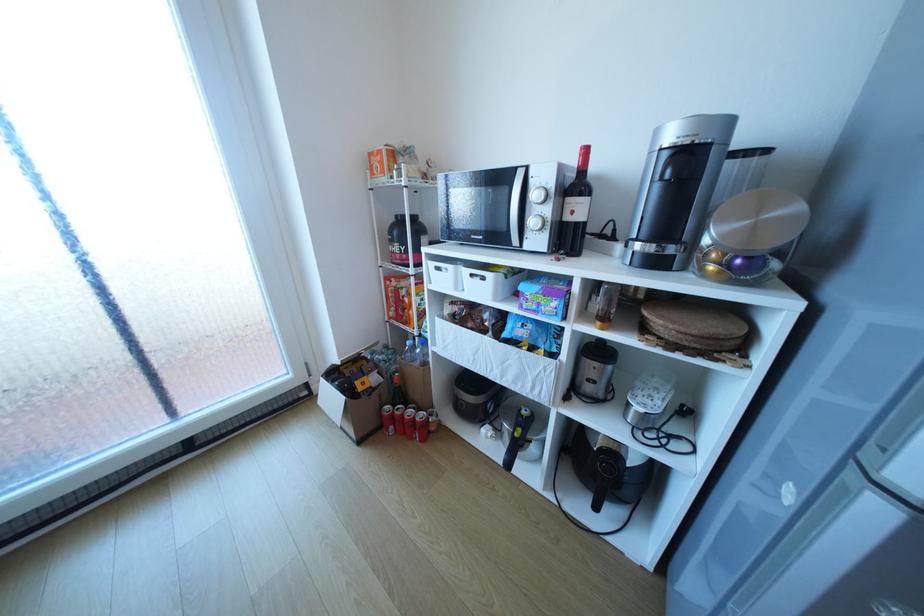
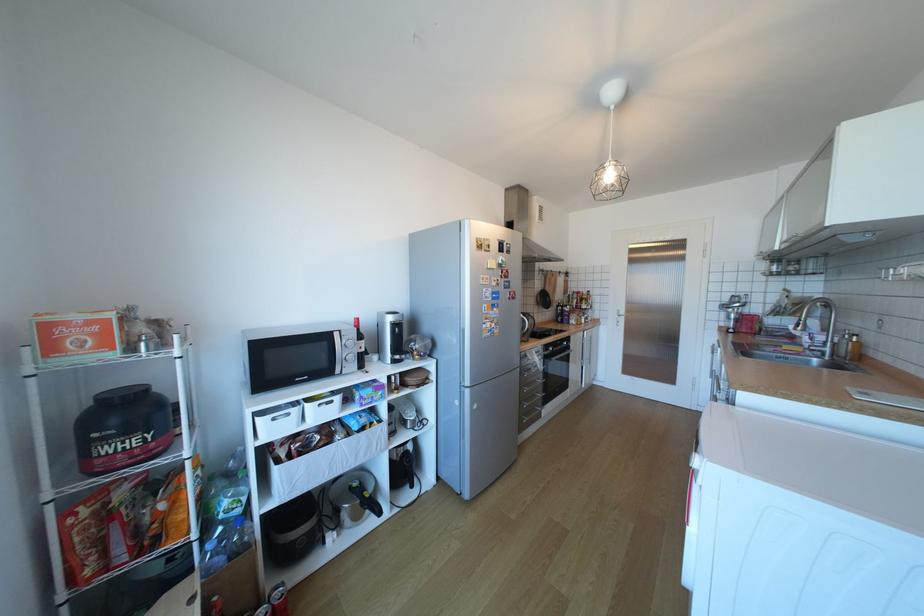
Find the pixel in the second image that matches point 492,278 in the first image.

(341, 402)